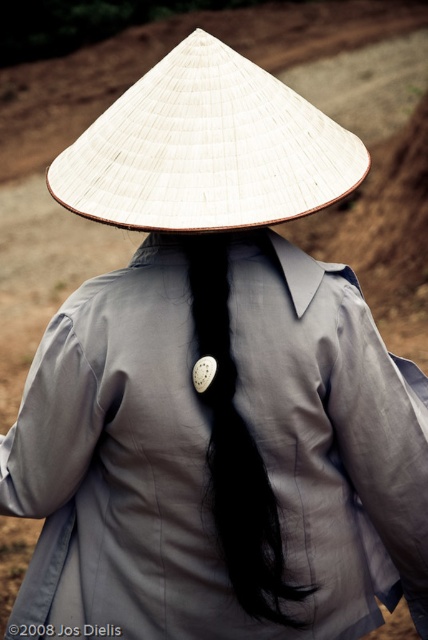
Between white woven straw hat at center and black matte hair at center, which one has more height?

With more height is black matte hair at center.

Between point (115, 225) and point (234, 497), which one is positioned behind?

Positioned behind is point (234, 497).

Locate an element on the screen. white woven straw hat at center is located at coordinates (207, 148).